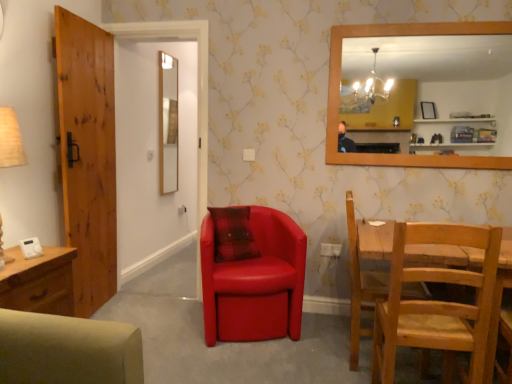
Question: Does wooden door at left have a greater height compared to light brown wooden chair at lower right, positioned as the 1th chair in right-to-left order?

Choices:
 (A) no
 (B) yes

Answer: (B)

Question: Is wooden door at left next to light brown wooden chair at lower right, positioned as the 1th chair in right-to-left order?

Choices:
 (A) no
 (B) yes

Answer: (A)

Question: Is there a large distance between wooden door at left and light brown wooden chair at lower right, arranged as the 2th chair when viewed from the left?

Choices:
 (A) yes
 (B) no

Answer: (A)

Question: Is wooden door at left closer to the viewer compared to light brown wooden chair at lower right, arranged as the 2th chair when viewed from the left?

Choices:
 (A) yes
 (B) no

Answer: (B)

Question: From a real-world perspective, is wooden door at left physically below light brown wooden chair at lower right, positioned as the 1th chair in right-to-left order?

Choices:
 (A) yes
 (B) no

Answer: (B)

Question: Is matte red leather armchair at center, the 2th chair viewed from the right, bigger or smaller than wooden frame mirror at upper right, the second mirror in the left-to-right sequence?

Choices:
 (A) big
 (B) small

Answer: (A)

Question: Based on their positions, is matte red leather armchair at center, the 2th chair viewed from the right, located to the left or right of wooden frame mirror at upper right, the 2th mirror in the back-to-front sequence?

Choices:
 (A) right
 (B) left

Answer: (B)

Question: From their relative heights in the image, would you say matte red leather armchair at center, which is the first chair from left to right, is taller or shorter than wooden frame mirror at upper right, the 2th mirror in the back-to-front sequence?

Choices:
 (A) tall
 (B) short

Answer: (B)

Question: Considering the positions of matte red leather armchair at center, the 2th chair viewed from the right, and wooden frame mirror at upper right, the second mirror in the left-to-right sequence, in the image, is matte red leather armchair at center, the 2th chair viewed from the right, wider or thinner than wooden frame mirror at upper right, the second mirror in the left-to-right sequence,?

Choices:
 (A) wide
 (B) thin

Answer: (A)

Question: Would you say smooth wooden mirror at center, the second mirror from the right, is inside or outside light brown wooden chair at lower right, positioned as the 1th chair in right-to-left order?

Choices:
 (A) inside
 (B) outside

Answer: (B)

Question: From the image's perspective, is smooth wooden mirror at center, the second mirror from the front, positioned above or below light brown wooden chair at lower right, arranged as the 2th chair when viewed from the left?

Choices:
 (A) above
 (B) below

Answer: (A)

Question: Considering the positions of smooth wooden mirror at center, the second mirror from the front, and light brown wooden chair at lower right, arranged as the 2th chair when viewed from the left, in the image, is smooth wooden mirror at center, the second mirror from the front, bigger or smaller than light brown wooden chair at lower right, arranged as the 2th chair when viewed from the left,?

Choices:
 (A) small
 (B) big

Answer: (A)

Question: Would you say smooth wooden mirror at center, which appears as the first mirror when viewed from the left, is to the left or to the right of light brown wooden chair at lower right, arranged as the 2th chair when viewed from the left, in the picture?

Choices:
 (A) right
 (B) left

Answer: (B)

Question: From the image's perspective, is wooden door at left positioned above or below light brown wooden chair at lower right, arranged as the 2th chair when viewed from the left?

Choices:
 (A) above
 (B) below

Answer: (A)

Question: Is wooden door at left inside or outside of light brown wooden chair at lower right, positioned as the 1th chair in right-to-left order?

Choices:
 (A) inside
 (B) outside

Answer: (B)